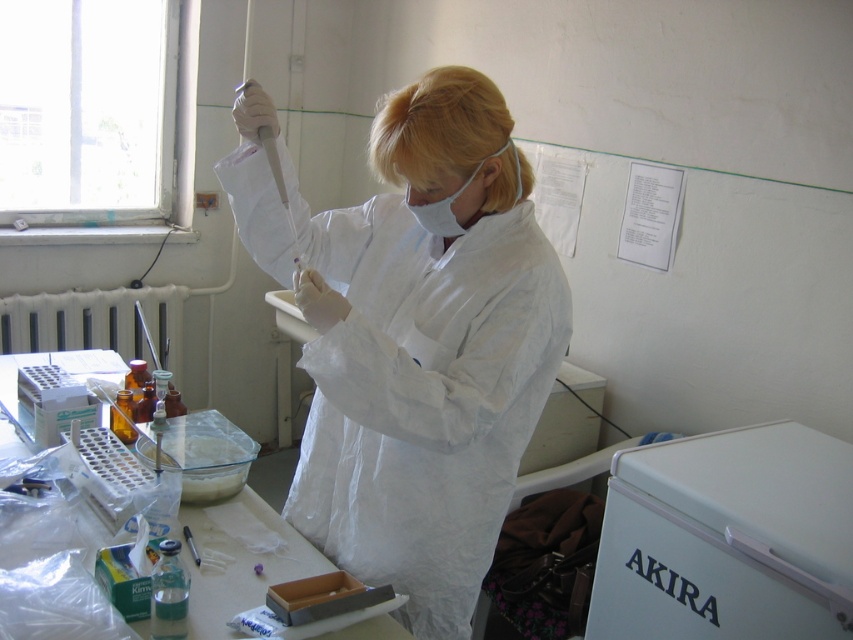
Is white plastic radiator at left above clear plastic tray at center?

Indeed, white plastic radiator at left is positioned over clear plastic tray at center.

In order to click on white plastic radiator at left in this screenshot , I will do `click(97, 323)`.

Measure the distance between point (169, 348) and camera.

Point (169, 348) is 10.78 feet from camera.

Locate an element on the screen. The width and height of the screenshot is (853, 640). white plastic radiator at left is located at coordinates (97, 323).

Which is in front, point (492, 221) or point (251, 492)?

Positioned in front is point (492, 221).

Based on the photo, who is taller, white paper lab coat at center or clear plastic tray at center?

With more height is white paper lab coat at center.

Between point (345, 465) and point (265, 502), which one is positioned in front?

Point (345, 465)

The height and width of the screenshot is (640, 853). I want to click on white paper lab coat at center, so coord(415,339).

Does white paper lab coat at center appear under white plastic refrigerator at lower right?

No, white paper lab coat at center is not below white plastic refrigerator at lower right.

Which is more to the right, white paper lab coat at center or white plastic refrigerator at lower right?

Positioned to the right is white plastic refrigerator at lower right.

Between point (318, 244) and point (790, 580), which one is positioned behind?

Positioned behind is point (318, 244).

Identify the location of white paper lab coat at center. The height and width of the screenshot is (640, 853). (415, 339).